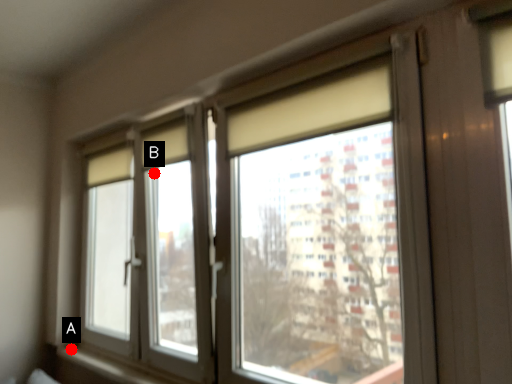
Question: Two points are circled on the image, labeled by A and B beside each circle. Which point appears closest to the camera in this image?

Choices:
 (A) A is closer
 (B) B is closer

Answer: (B)